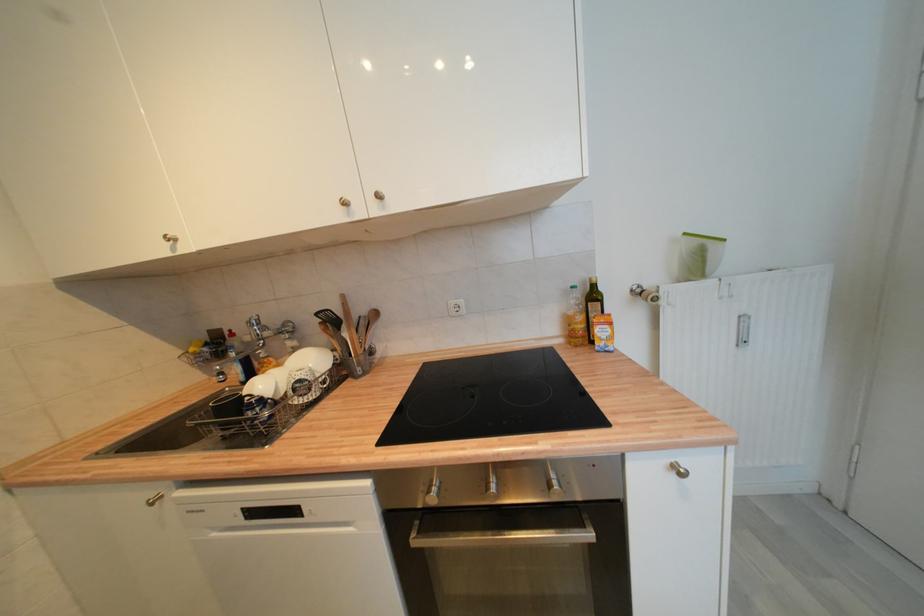
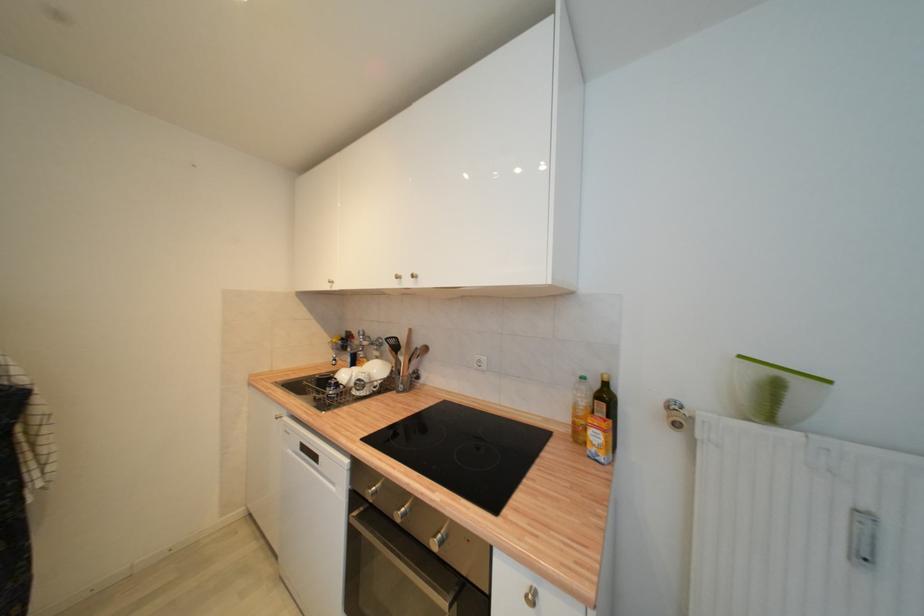
The point at [322,315] is marked in the first image. Where is the corresponding point in the second image?

(392, 341)